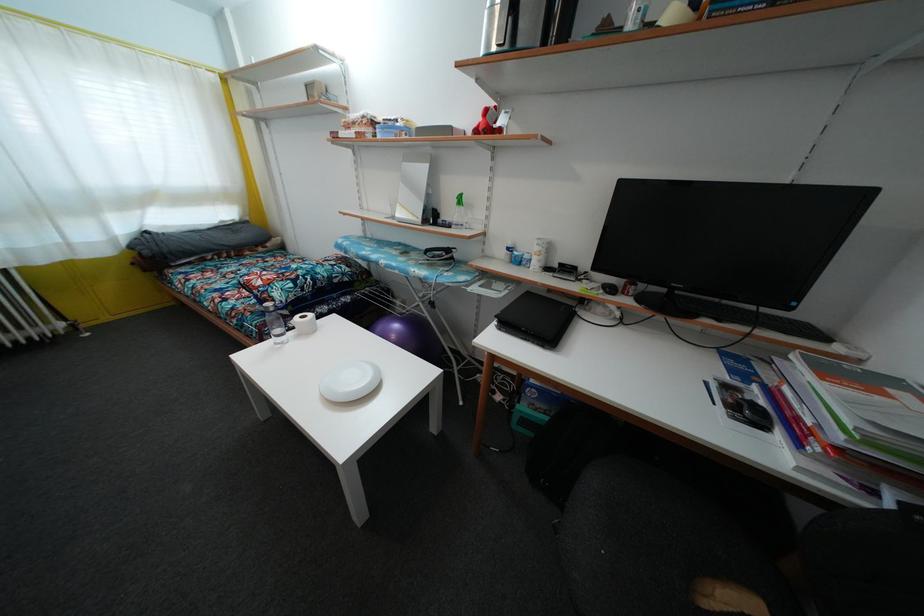
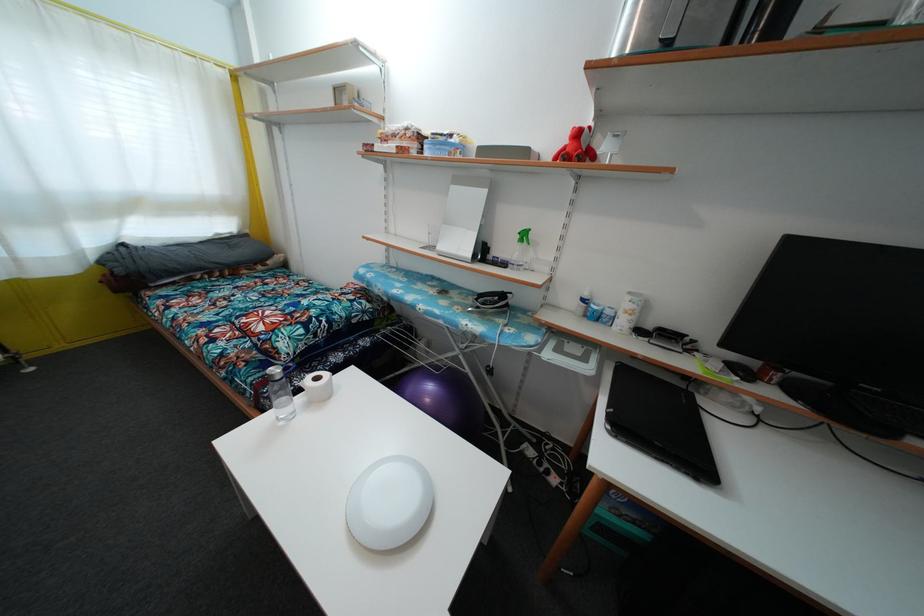
Find the pixel in the second image that matches point 275,315 in the first image.

(282, 384)